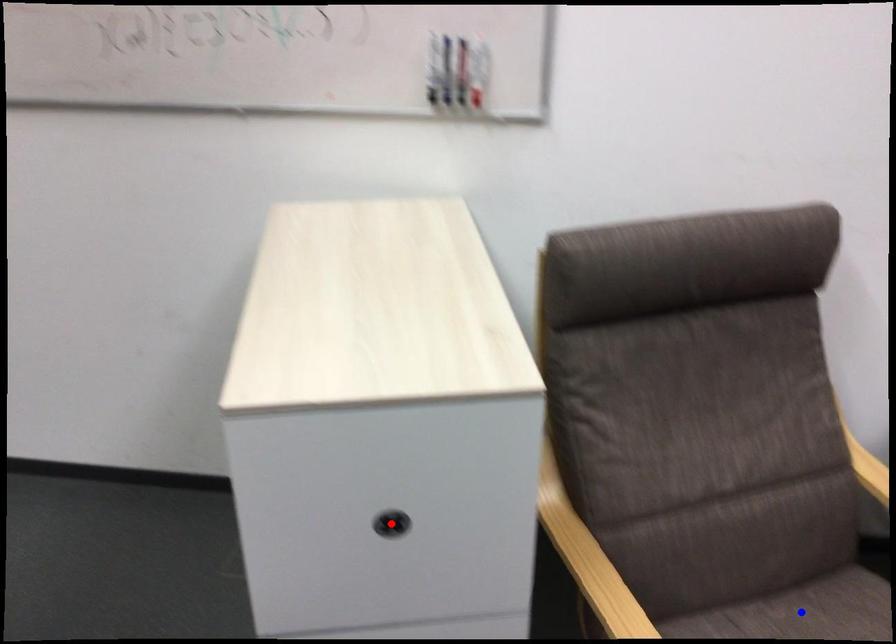
Question: In the image, two points are highlighted. Which point is nearer to the camera? Reply with the corresponding letter.

Choices:
 (A) blue point
 (B) red point

Answer: (B)